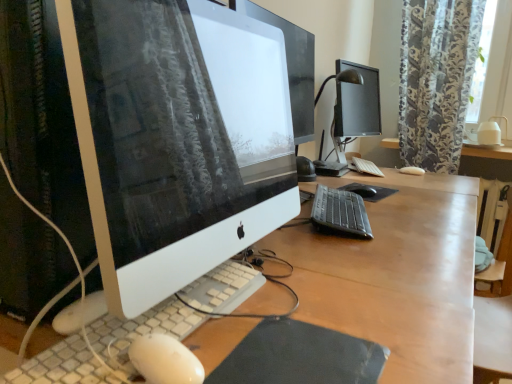
This screenshot has height=384, width=512. I want to click on free space in front of black plastic keyboard at center, the second computer keyboard from the front, so click(370, 249).